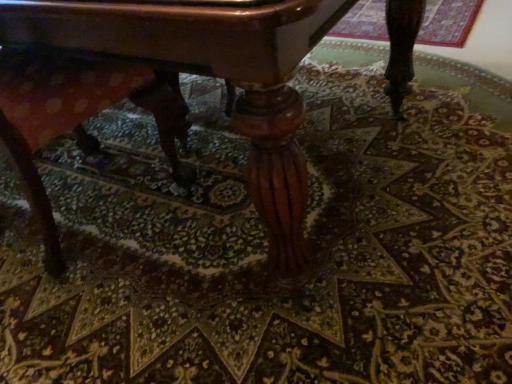
Measure the distance between point (35, 89) and camera.

1.04 meters.

This screenshot has width=512, height=384. Describe the element at coordinates (78, 117) in the screenshot. I see `wooden swivel chair at lower left` at that location.

Where is `wooden swivel chair at lower left`? wooden swivel chair at lower left is located at coordinates (78, 117).

Find the location of a particular element. The height and width of the screenshot is (384, 512). polished wood table at center is located at coordinates (207, 75).

What do you see at coordinates (207, 75) in the screenshot? The image size is (512, 384). I see `polished wood table at center` at bounding box center [207, 75].

This screenshot has height=384, width=512. Find the location of `wooden swivel chair at lower left`. wooden swivel chair at lower left is located at coordinates (78, 117).

Between polished wood table at center and wooden swivel chair at lower left, which one appears on the right side from the viewer's perspective?

polished wood table at center is more to the right.

Considering the relative positions of polished wood table at center and wooden swivel chair at lower left in the image provided, is polished wood table at center in front of wooden swivel chair at lower left?

Yes, polished wood table at center is closer to the camera.

Which is behind, point (391, 75) or point (37, 71)?

Point (391, 75)

From the image's perspective, which is below, polished wood table at center or wooden swivel chair at lower left?

wooden swivel chair at lower left is shown below in the image.

From a real-world perspective, is polished wood table at center above or below wooden swivel chair at lower left?

Clearly, from a real-world perspective, polished wood table at center is above wooden swivel chair at lower left.

Which object is wider, polished wood table at center or wooden swivel chair at lower left?

polished wood table at center is wider.

Considering the relative sizes of polished wood table at center and wooden swivel chair at lower left in the image provided, is polished wood table at center shorter than wooden swivel chair at lower left?

In fact, polished wood table at center may be taller than wooden swivel chair at lower left.

Who is bigger, polished wood table at center or wooden swivel chair at lower left?

polished wood table at center is bigger.

Is polished wood table at center inside the boundaries of wooden swivel chair at lower left, or outside?

polished wood table at center is not enclosed by wooden swivel chair at lower left.

Are polished wood table at center and wooden swivel chair at lower left beside each other?

No, polished wood table at center is not making contact with wooden swivel chair at lower left.

In the scene shown: Could you tell me if polished wood table at center is turned towards wooden swivel chair at lower left?

Yes, polished wood table at center faces towards wooden swivel chair at lower left.

How different are the orientations of polished wood table at center and wooden swivel chair at lower left in degrees?

They differ by 176 degrees in their facing directions.

Measure the distance between polished wood table at center and wooden swivel chair at lower left.

4.64 inches.

Image resolution: width=512 pixels, height=384 pixels. In order to click on table located on the right of wooden swivel chair at lower left in this screenshot , I will do `click(207, 75)`.

Between wooden swivel chair at lower left and polished wood table at center, which one appears on the left side from the viewer's perspective?

wooden swivel chair at lower left.

Considering their positions, is wooden swivel chair at lower left located in front of or behind polished wood table at center?

In the image, wooden swivel chair at lower left appears behind polished wood table at center.

Considering the points (177, 121) and (293, 228), which point is in front, point (177, 121) or point (293, 228)?

Positioned in front is point (293, 228).

From the image's perspective, who appears lower, wooden swivel chair at lower left or polished wood table at center?

wooden swivel chair at lower left.

From a real-world perspective, is wooden swivel chair at lower left over polished wood table at center?

Incorrect, from a real-world perspective, wooden swivel chair at lower left is lower than polished wood table at center.

Which of these two, wooden swivel chair at lower left or polished wood table at center, is thinner?

With smaller width is wooden swivel chair at lower left.

Looking at this image, which of these two, wooden swivel chair at lower left or polished wood table at center, stands shorter?

With less height is wooden swivel chair at lower left.

Between wooden swivel chair at lower left and polished wood table at center, which one has larger size?

polished wood table at center.

Is wooden swivel chair at lower left completely or partially outside of polished wood table at center?

Actually, wooden swivel chair at lower left is at least partially inside polished wood table at center.

Is wooden swivel chair at lower left next to polished wood table at center?

They are not placed beside each other.

Is wooden swivel chair at lower left aimed at polished wood table at center?

Yes, wooden swivel chair at lower left is oriented towards polished wood table at center.

Identify the location of table above the wooden swivel chair at lower left (from a real-world perspective). Image resolution: width=512 pixels, height=384 pixels. (207, 75).

Locate an element on the screen. Image resolution: width=512 pixels, height=384 pixels. swivel chair below the polished wood table at center (from a real-world perspective) is located at coordinates (78, 117).

Locate an element on the screen. swivel chair behind the polished wood table at center is located at coordinates (78, 117).